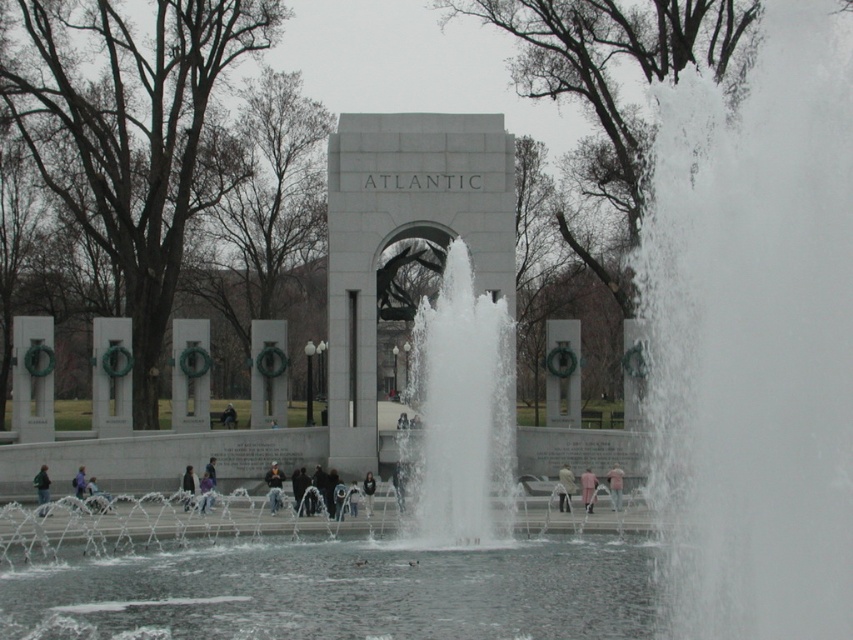
Locate an element on the screen. light brown leather jacket at center is located at coordinates (274, 486).

Is point (277, 499) closer to camera compared to point (196, 477)?

Yes, point (277, 499) is closer to viewer.

Locate an element on the screen. The image size is (853, 640). light brown leather jacket at center is located at coordinates (274, 486).

Is light brown leather jacket at center taller than pink fabric at center?

Indeed, light brown leather jacket at center has a greater height compared to pink fabric at center.

Between light brown leather jacket at center and pink fabric at center, which one appears on the right side from the viewer's perspective?

Positioned to the right is pink fabric at center.

Does point (270, 474) come farther from viewer compared to point (560, 502)?

Yes.

Identify the location of light brown leather jacket at center. This screenshot has width=853, height=640. (274, 486).

Can you confirm if pink fabric at center is taller than pink fabric coat at center?

In fact, pink fabric at center may be shorter than pink fabric coat at center.

Does point (566, 497) come in front of point (593, 490)?

No.

Between point (570, 477) and point (593, 493), which one is positioned behind?

The point (570, 477) is behind.

At what (x,y) coordinates should I click in order to perform the action: click on pink fabric at center. Please return your answer as a coordinate pair (x, y). This screenshot has width=853, height=640. Looking at the image, I should click on (566, 486).